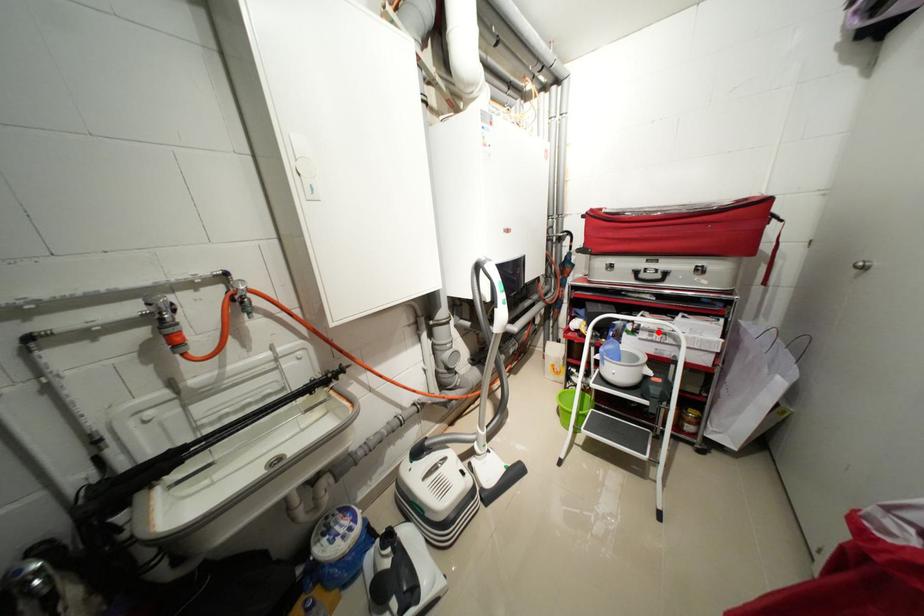
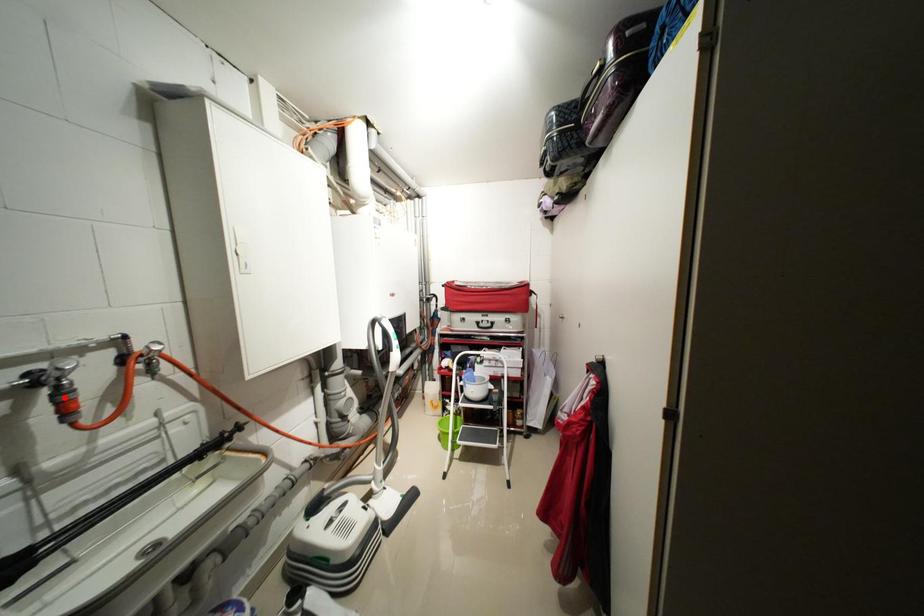
I am providing you with two images of the same scene from different viewpoints. A red point is marked on the first image and another point is marked on the second image. Is the red point in image1 aligned with the point shown in image2?

No